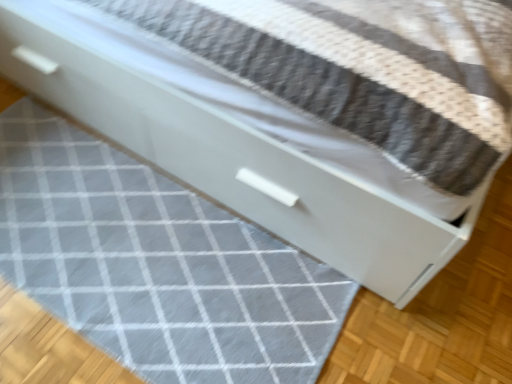
Describe the element at coordinates (156, 264) in the screenshot. I see `gray textured bath mat at center` at that location.

At what (x,y) coordinates should I click in order to perform the action: click on gray textured bath mat at center. Please return your answer as a coordinate pair (x, y). The height and width of the screenshot is (384, 512). Looking at the image, I should click on (156, 264).

Locate an element on the screen. This screenshot has width=512, height=384. gray textured bath mat at center is located at coordinates (156, 264).